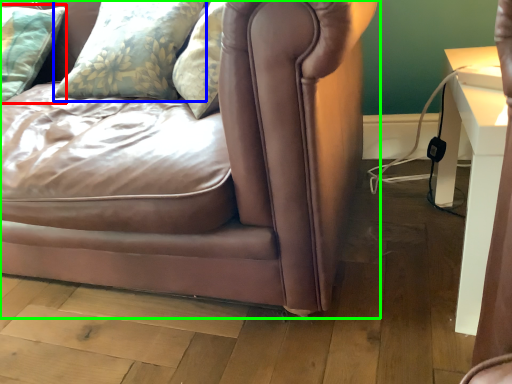
Question: Which object is positioned closest to pillow (highlighted by a red box)? Select from pillow (highlighted by a blue box) and studio couch (highlighted by a green box).

Choices:
 (A) pillow
 (B) studio couch

Answer: (A)